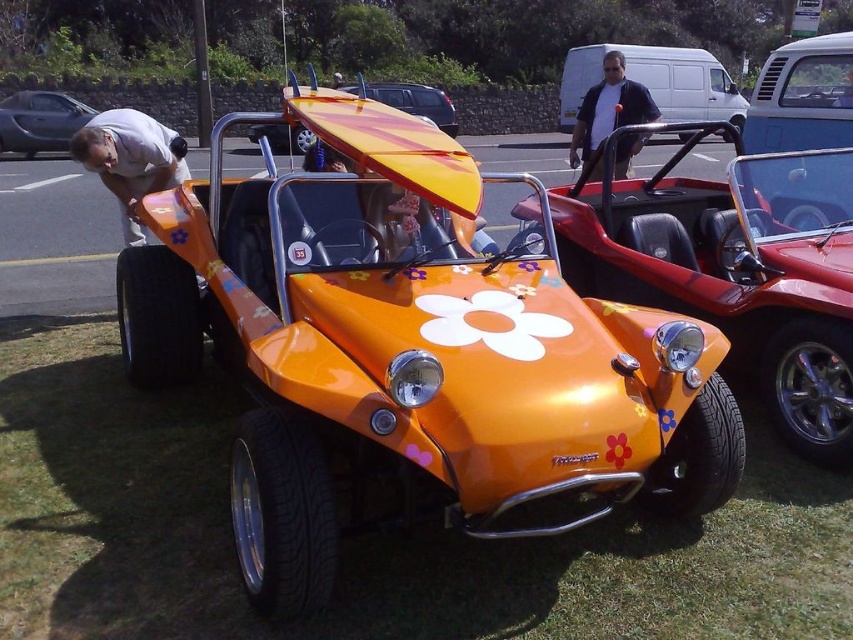
You are standing at the orange dune buggy parked on grass with a surfboard on its roof. There are two points marked in the image. The first point is at coordinates point(90, 460) and the second point is at point(410, 112). If you want to walk from the first point to the second point, which direction should you move relative to the orange dune buggy?

To move from point(90, 460) to point(410, 112), you should move backward relative to the orange dune buggy because point(90, 460) is in front of point(410, 112).

You are standing at the point labeled point [656,83] in the image. Which object is directly in front of you?

The matte white van at center is directly in front of you at point [656,83].

You are trying to decide whether to park your car behind the matte white van at center or next to the dark blue jacket at upper center. Based on their sizes, which spot would allow your car to fit better?

The matte white van at center is larger than the dark blue jacket at upper center. Therefore, parking next to the dark blue jacket at upper center would provide more space for your car to fit better.